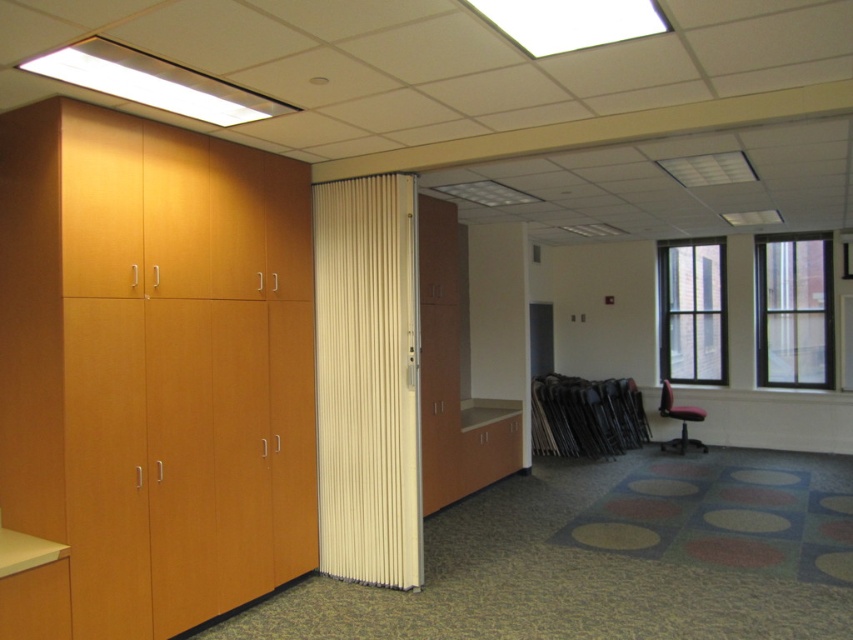
Question: Does white fabric curtain at center appear on the right side of red fabric chair at right?

Choices:
 (A) no
 (B) yes

Answer: (A)

Question: Does white fabric curtain at center appear on the left side of red fabric chair at right?

Choices:
 (A) no
 (B) yes

Answer: (B)

Question: Which point is closer to the camera taking this photo?

Choices:
 (A) pyautogui.click(x=683, y=442)
 (B) pyautogui.click(x=392, y=422)

Answer: (B)

Question: Which object appears farthest from the camera in this image?

Choices:
 (A) matte wood cabinet at left
 (B) white fabric curtain at center
 (C) red fabric chair at right

Answer: (C)

Question: Which point is farther to the camera?

Choices:
 (A) red fabric chair at right
 (B) matte wood cabinet at left
 (C) white fabric curtain at center

Answer: (A)

Question: Does matte wood cabinet at left have a lesser width compared to red fabric chair at right?

Choices:
 (A) no
 (B) yes

Answer: (A)